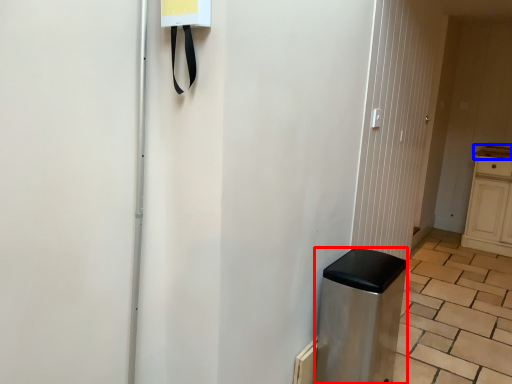
Question: Which point is closer to the camera, appliance (highlighted by a red box) or counter top (highlighted by a blue box)?

Choices:
 (A) appliance
 (B) counter top

Answer: (A)